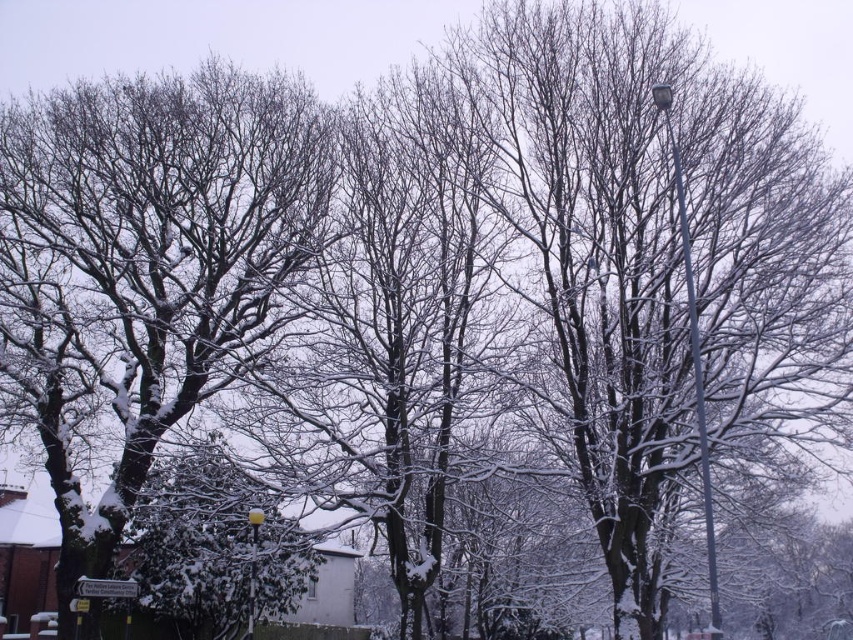
Does snow-covered branches at left have a smaller size compared to metallic gray pole at right?

Correct, snow-covered branches at left occupies less space than metallic gray pole at right.

Which is in front, point (78, 412) or point (711, 570)?

Point (711, 570) is in front.

In order to click on snow-covered branches at left in this screenshot , I will do `click(146, 264)`.

Which of these two, metallic gray pole at right or yellow glass lamp post at center, stands taller?

Standing taller between the two is metallic gray pole at right.

Is metallic gray pole at right behind yellow glass lamp post at center?

No.

In order to click on metallic gray pole at right in this screenshot , I will do `click(693, 356)`.

Between snow-covered branches at left and yellow glass lamp post at center, which one appears on the right side from the viewer's perspective?

yellow glass lamp post at center is more to the right.

Is snow-covered branches at left wider than yellow glass lamp post at center?

Yes, snow-covered branches at left is wider than yellow glass lamp post at center.

Is point (251, 81) in front of point (247, 628)?

Yes.

At what (x,y) coordinates should I click in order to perform the action: click on snow-covered branches at left. Please return your answer as a coordinate pair (x, y). Looking at the image, I should click on (146, 264).